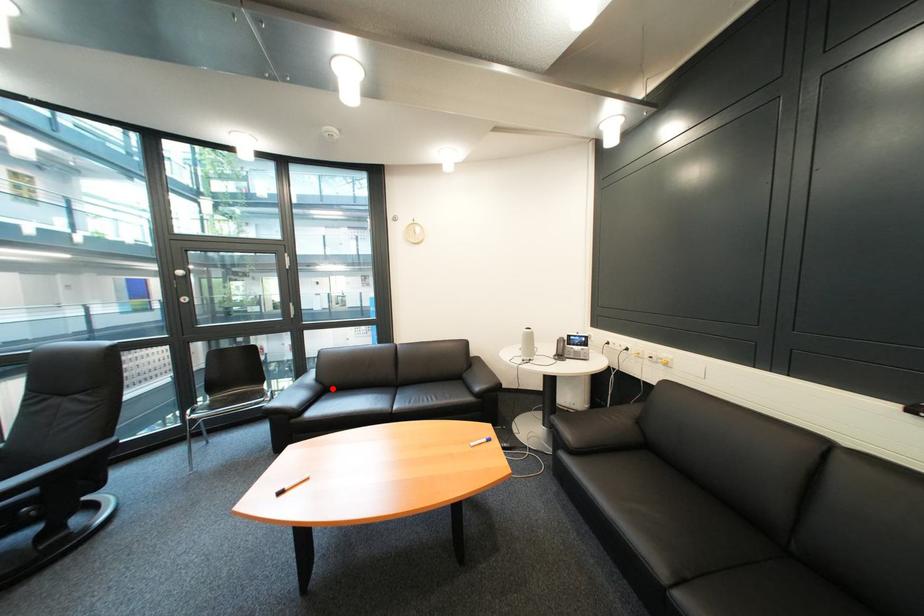
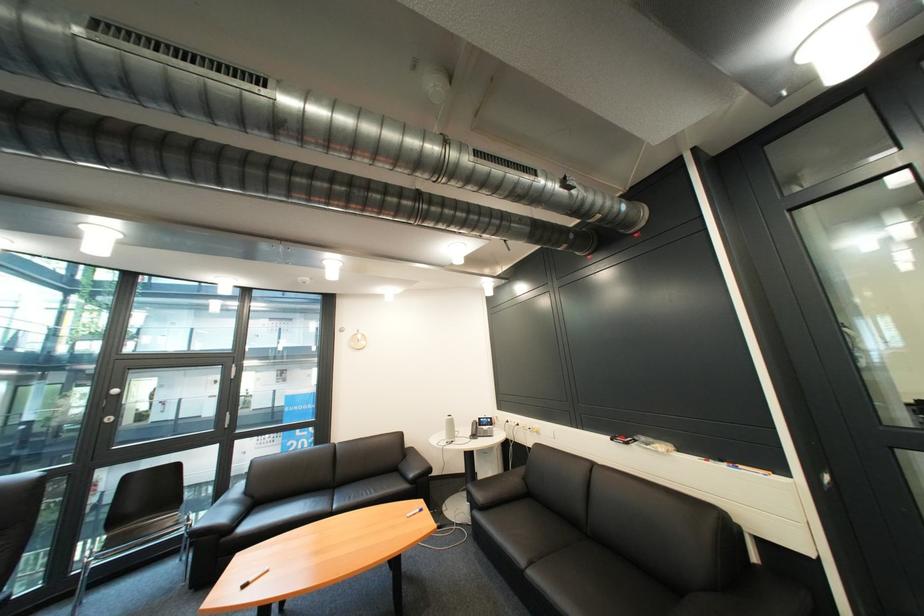
Question: I am providing you with two images of the same scene from different viewpoints. Image1 has a red point marked. In image2, the corresponding 3D location appears at what relative position? Reply with the corresponding letter.

Choices:
 (A) Closer
 (B) Farther

Answer: (A)